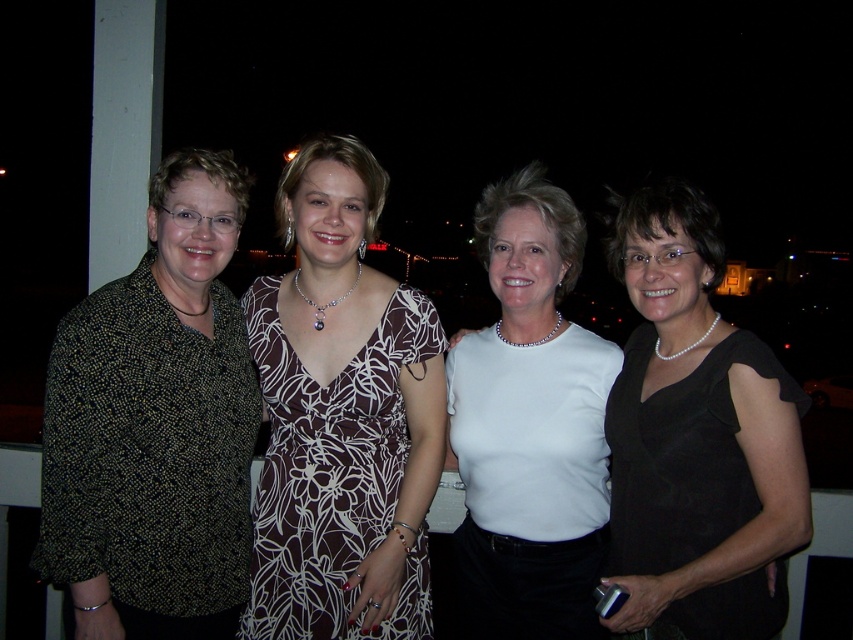
Does dark green textured blouse at left come behind black satin dress at right?

Yes, dark green textured blouse at left is behind black satin dress at right.

Can you confirm if dark green textured blouse at left is taller than black satin dress at right?

Yes.

Where is `dark green textured blouse at left`? The image size is (853, 640). dark green textured blouse at left is located at coordinates (155, 426).

The width and height of the screenshot is (853, 640). What do you see at coordinates (529, 426) in the screenshot?
I see `white satin blouse at center` at bounding box center [529, 426].

Which is below, white satin blouse at center or black satin dress at right?

black satin dress at right is lower down.

Is point (548, 636) positioned behind point (776, 564)?

Yes.

This screenshot has width=853, height=640. Identify the location of white satin blouse at center. (529, 426).

Locate an element on the screen. white satin blouse at center is located at coordinates (529, 426).

Which is more to the right, white satin blouse at center or brown floral dress at center?

Positioned to the right is white satin blouse at center.

Is point (570, 285) positioned in front of point (393, 376)?

That is False.

Find the location of `white satin blouse at center`. white satin blouse at center is located at coordinates (529, 426).